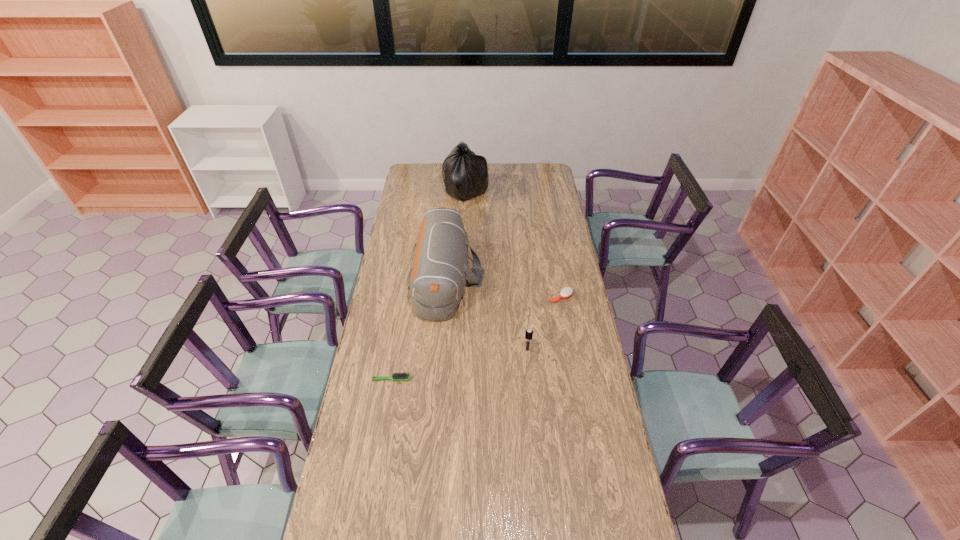
The image size is (960, 540). Identify the location of vacant space at the right edge. (546, 188).

The image size is (960, 540). What are the coordinates of `free space at the far right corner` in the screenshot? It's located at (539, 168).

The image size is (960, 540). I want to click on empty space between the plastic bag and the fourth tallest object, so click(x=514, y=244).

Locate an element on the screen. blank region between the fourth farthest object and the duffel bag is located at coordinates (487, 314).

Locate an element on the screen. free space between the second tallest object and the shortest object is located at coordinates (420, 328).

What are the coordinates of `empty location between the second shortest hairbrush and the shortest object` in the screenshot? It's located at (476, 338).

The height and width of the screenshot is (540, 960). I want to click on free space between the third tallest object and the plastic bag, so click(x=496, y=270).

The width and height of the screenshot is (960, 540). What are the coordinates of `free space between the nearest hairbrush and the duffel bag` in the screenshot? It's located at (420, 328).

At what (x,y) coordinates should I click in order to perform the action: click on free area in between the nearest hairbrush and the farthest hairbrush. Please return your answer as a coordinate pair (x, y). Looking at the image, I should click on (476, 338).

The width and height of the screenshot is (960, 540). I want to click on free space between the rightmost object and the nearest hairbrush, so click(476, 338).